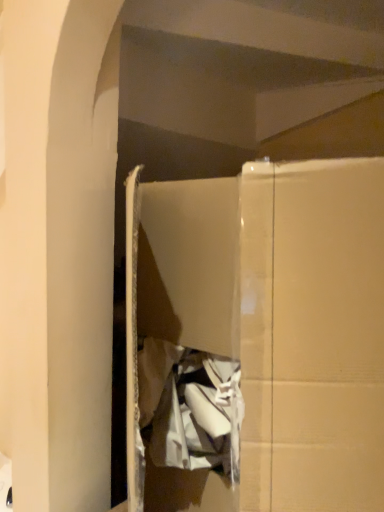
This screenshot has height=512, width=384. What do you see at coordinates (257, 338) in the screenshot?
I see `white cardboard box at center` at bounding box center [257, 338].

Image resolution: width=384 pixels, height=512 pixels. Find the location of `white cardboard box at center`. white cardboard box at center is located at coordinates (257, 338).

This screenshot has height=512, width=384. In order to click on white cardboard box at center in this screenshot , I will do `click(257, 338)`.